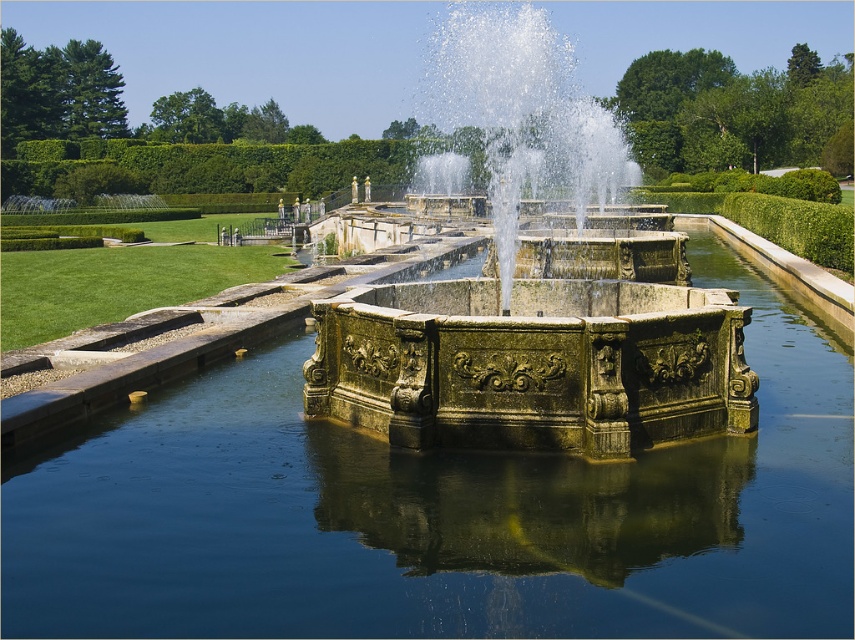
Does greenish stone water at center have a greater height compared to greenish stone fountain at center?

No, greenish stone water at center is not taller than greenish stone fountain at center.

Does point (233, 380) come behind point (498, 225)?

Yes, point (233, 380) is farther from viewer.

Where is `greenish stone water at center`? greenish stone water at center is located at coordinates (441, 515).